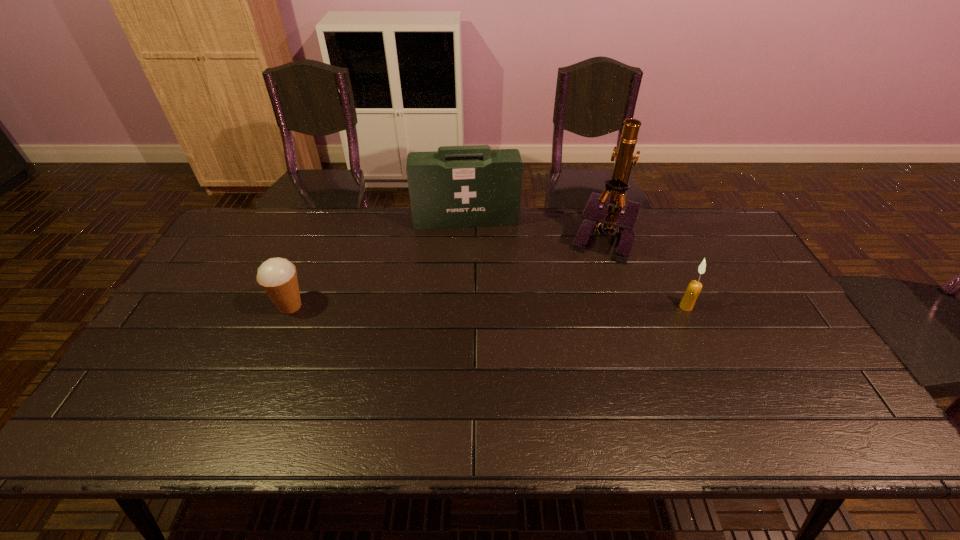
Locate an element on the screen. free spot on the desktop that is between the leftmost object and the rightmost object and is positioned on the front-facing side of the third shortest object is located at coordinates (472, 306).

Identify the location of free space on the desktop that is between the icecream and the candle and is positioned at the eyepiece of the second object from right to left. The image size is (960, 540). tap(502, 306).